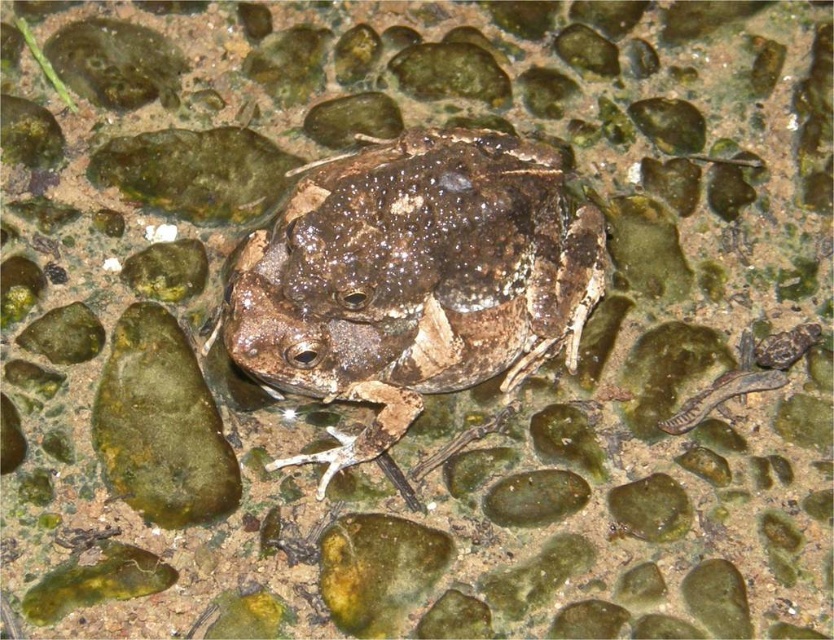
Can you confirm if speckled brown skin at center is positioned below green mossy rock at center?

Actually, speckled brown skin at center is above green mossy rock at center.

Is speckled brown skin at center shorter than green mossy rock at center?

No, speckled brown skin at center is not shorter than green mossy rock at center.

Between point (275, 371) and point (183, 337), which one is positioned behind?

Point (183, 337)

Identify the location of speckled brown skin at center. The width and height of the screenshot is (834, 640). (413, 278).